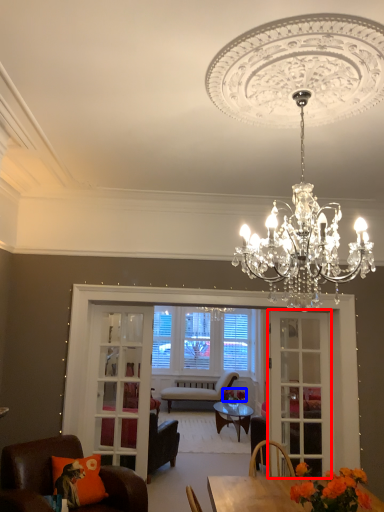
Question: Which of the following is the closest to the observer, screen door (highlighted by a red box) or flower (highlighted by a blue box)?

Choices:
 (A) screen door
 (B) flower

Answer: (A)